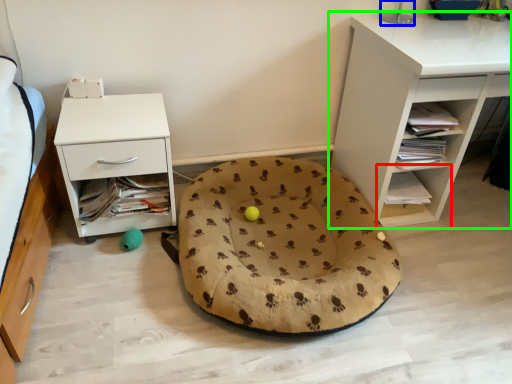
Question: Which is nearer to the shelf (highlighted by a red box)? table lamp (highlighted by a blue box) or shelf (highlighted by a green box).

Choices:
 (A) table lamp
 (B) shelf

Answer: (B)